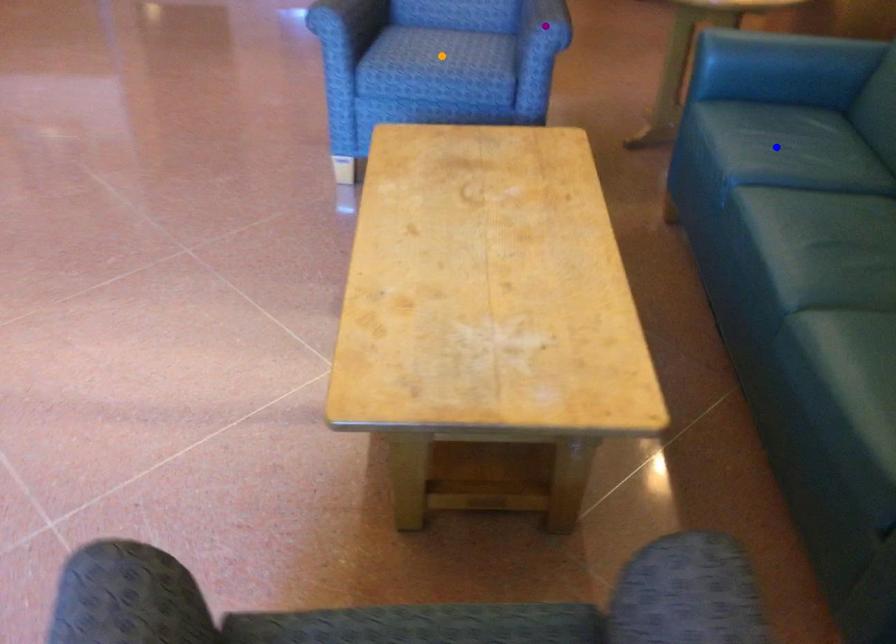
Order these from farthest to nearest:
blue point | orange point | purple point

1. orange point
2. purple point
3. blue point